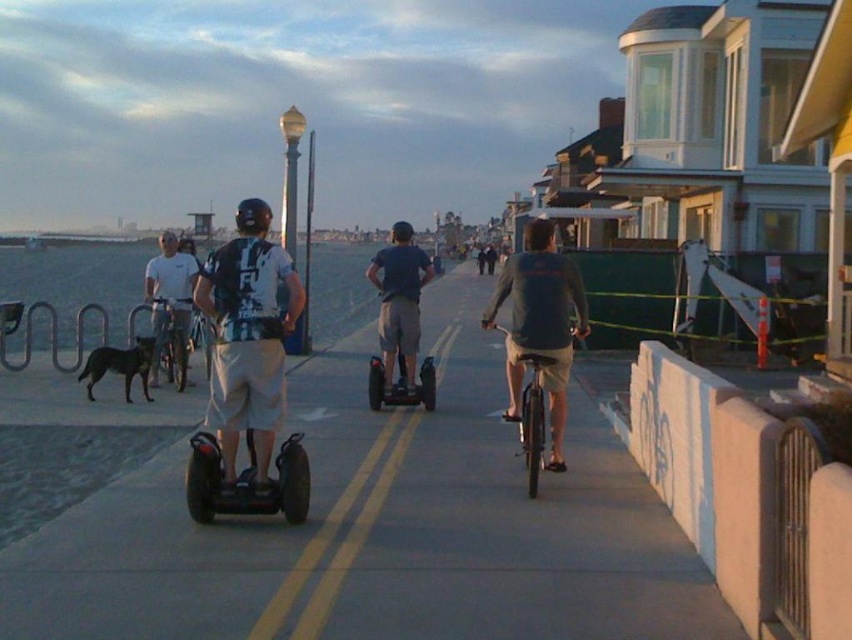
Question: Does black rubber segway at center have a smaller size compared to black matte hoverboard at center?

Choices:
 (A) no
 (B) yes

Answer: (B)

Question: Among these points, which one is nearest to the camera?

Choices:
 (A) (262, 204)
 (B) (186, 332)
 (C) (522, 356)
 (D) (338, 481)

Answer: (A)

Question: Is smooth concrete sidewalk at center to the right of black matte scooter at center from the viewer's perspective?

Choices:
 (A) yes
 (B) no

Answer: (B)

Question: Which of the following is the closest to the observer?

Choices:
 (A) (208, 506)
 (B) (87, 368)
 (C) (281, 470)

Answer: (A)

Question: Which of the following is the closest to the observer?

Choices:
 (A) [285, 509]
 (B) [243, 509]
 (C) [226, 472]
 (D) [177, 358]

Answer: (B)

Question: Can you confirm if smooth concrete sidewalk at center is positioned to the right of matte black shirt at center?

Choices:
 (A) no
 (B) yes

Answer: (B)